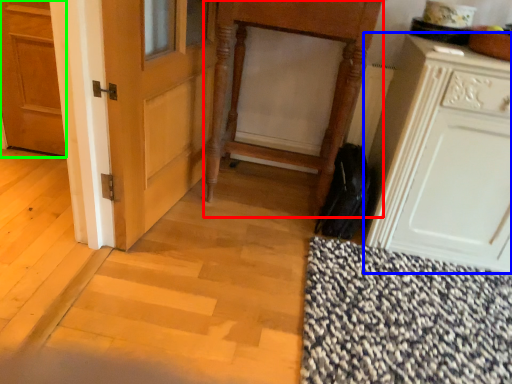
Question: Which object is the farthest from vanity (highlighted by a red box)? Choose among these: cabinetry (highlighted by a blue box) or door (highlighted by a green box).

Choices:
 (A) cabinetry
 (B) door

Answer: (B)